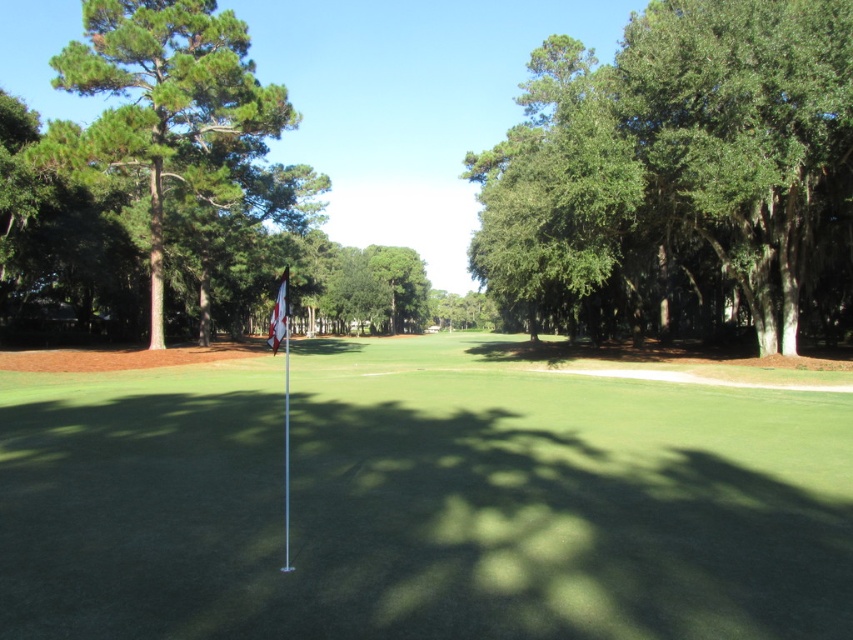
Based on the photo, you are a golfer standing on the fairway and want to hit the ball towards the hole. Which tree, the green leafy tree at right or the green textured tree at left, is closer to you?

The green leafy tree at right is closer to you because it is in front of the green textured tree at left, meaning it is positioned nearer to your current location on the fairway.

You are a golfer standing at the point marked as point (807, 144) on the golf course. You want to hit a ball to the flagpole located at the center of the green. If your golf ball travels in a straight line, how far will it have to travel to reach the flagpole?

The distance between point (807, 144) and the flagpole is 23.89 meters, so the golf ball will have to travel 23.89 meters to reach the flagpole.

You are a golfer preparing to putt on the green artificial turf at center. You notice a green leafy tree at right nearby. Which object occupies more space in the image?

The green leafy tree at right occupies more space in the image since the green artificial turf at center has a smaller size compared to it.